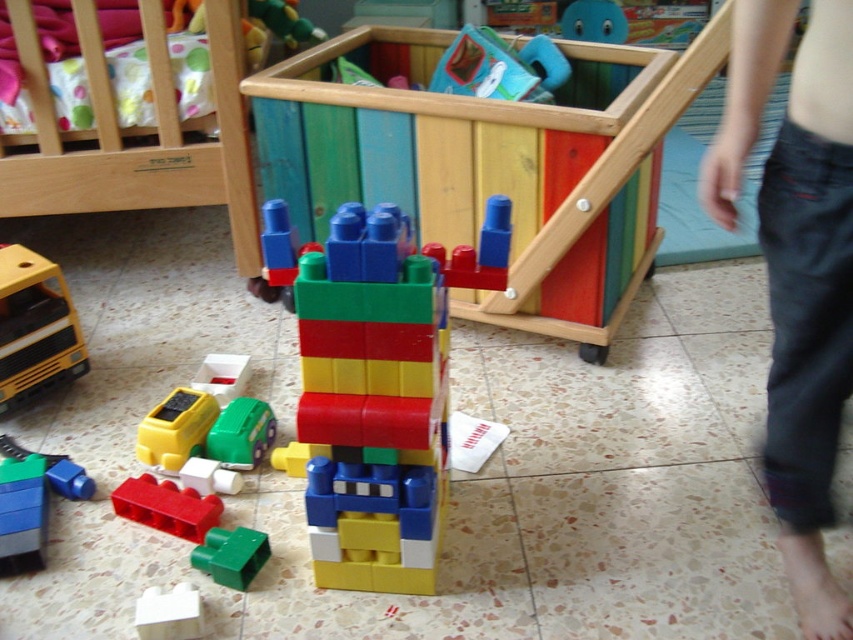
You are a parent trying to organize the playroom. You have a wooden crib at lower left and matte plastic blocks at lower left. Which object takes up more space in the playroom?

The wooden crib at lower left is bigger than the matte plastic blocks at lower left, so it takes up more space in the playroom.